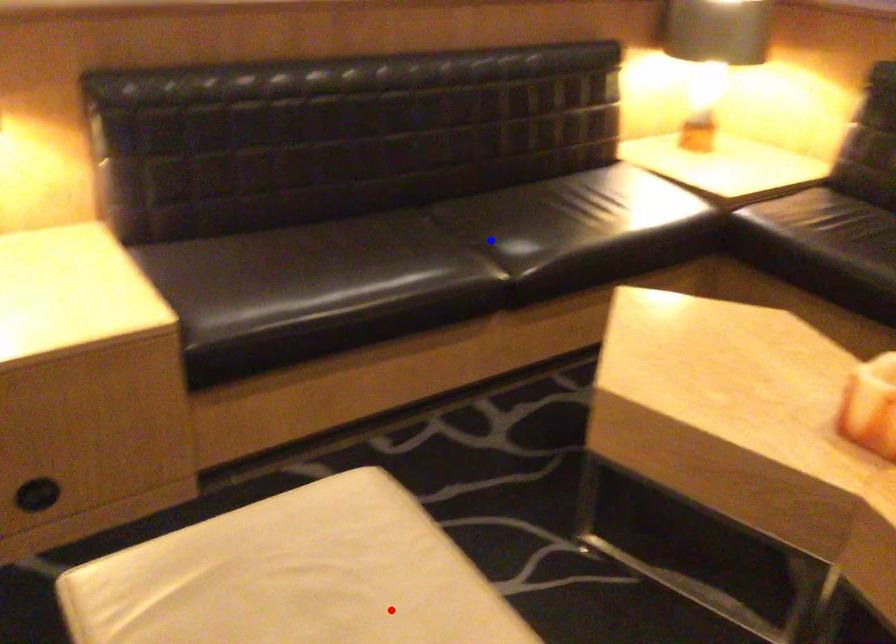
Question: In the image, two points are highlighted. Which point is nearer to the camera? Reply with the corresponding letter.

Choices:
 (A) blue point
 (B) red point

Answer: (B)